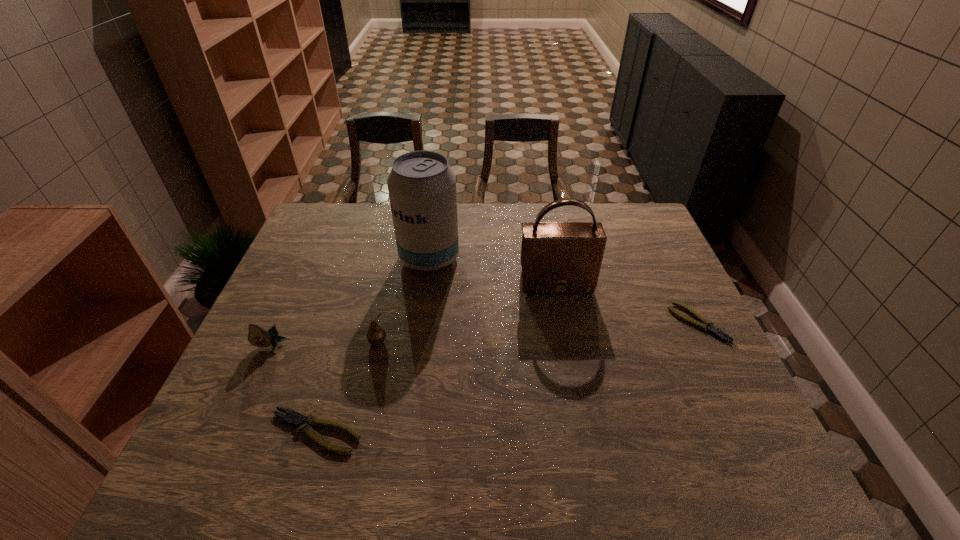
You are a GUI agent. You are given a task and a screenshot of the screen. Output one action in this format:
    pyautogui.click(x=<x>, y=<y>)
    Task: Click on the vacant space located on the left of the farther pliers
    This screenshot has height=540, width=960.
    Given the screenshot: What is the action you would take?
    (x=575, y=322)

The width and height of the screenshot is (960, 540). Identify the location of free space located on the front flap of the second tallest object. (566, 336).

The height and width of the screenshot is (540, 960). Identify the location of free region located on the right of the alcohol. (x=539, y=258).

Locate an element on the screen. Image resolution: width=960 pixels, height=540 pixels. free location located on the front of the pear is located at coordinates (367, 393).

The image size is (960, 540). I want to click on free location located on the seed side of the leftmost object, so click(239, 420).

I want to click on object situated at the far edge, so click(422, 187).

You are a GUI agent. You are given a task and a screenshot of the screen. Output one action in this format:
    pyautogui.click(x=<x>, y=<y>)
    Task: Click on the object located in the near edge section of the desktop
    This screenshot has width=960, height=540.
    Given the screenshot: What is the action you would take?
    pyautogui.click(x=296, y=419)

Locate an element on the screen. Image resolution: width=960 pixels, height=540 pixels. pliers at the left edge is located at coordinates (296, 419).

Locate an element on the screen. avocado located in the left edge section of the desktop is located at coordinates (257, 336).

This screenshot has height=540, width=960. Find the location of `object that is at the right edge`. object that is at the right edge is located at coordinates (704, 324).